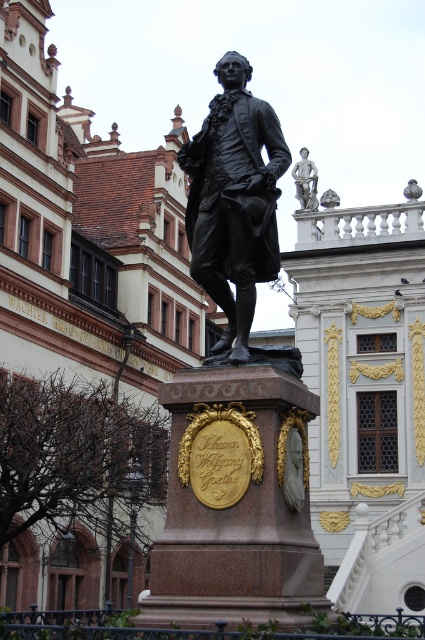
Question: Can you confirm if bronze statue at center is positioned below polished bronze statue at upper right?

Choices:
 (A) yes
 (B) no

Answer: (A)

Question: Which of the following is the closest to the observer?

Choices:
 (A) (303, 147)
 (B) (252, 173)

Answer: (B)

Question: Among these points, which one is farthest from the camera?

Choices:
 (A) click(x=238, y=125)
 (B) click(x=305, y=188)

Answer: (B)

Question: Can you confirm if bronze statue at center is bigger than polished bronze statue at upper right?

Choices:
 (A) yes
 (B) no

Answer: (A)

Question: Does bronze statue at center have a lesser width compared to polished bronze statue at upper right?

Choices:
 (A) yes
 (B) no

Answer: (B)

Question: Which point is closer to the camera taking this photo?

Choices:
 (A) (303, 156)
 (B) (263, 192)

Answer: (B)